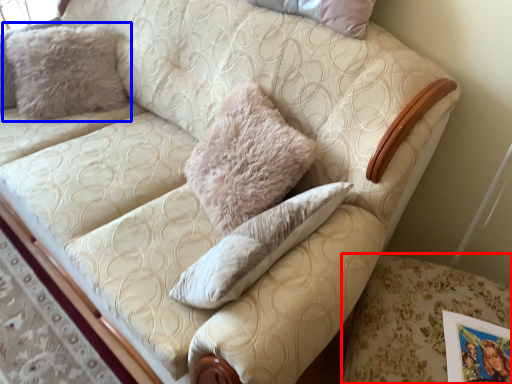
Question: Which object is further to the camera taking this photo, swivel chair (highlighted by a red box) or pillow (highlighted by a blue box)?

Choices:
 (A) swivel chair
 (B) pillow

Answer: (B)